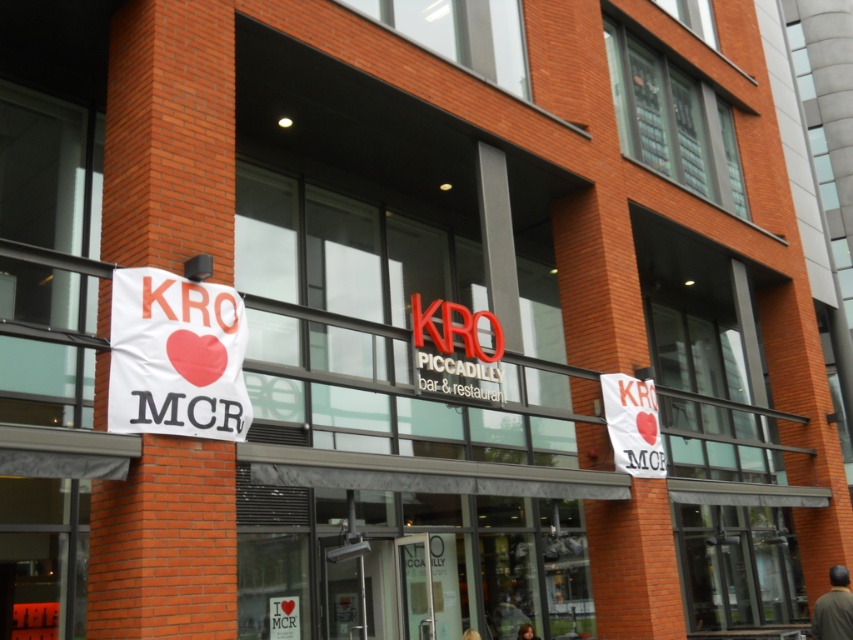
Is point (131, 320) less distant than point (653, 433)?

Yes.

Does white paper banner at left have a greater width compared to white paper banner at center?

Yes, white paper banner at left is wider than white paper banner at center.

Locate an element on the screen. This screenshot has width=853, height=640. white paper banner at left is located at coordinates (177, 356).

Locate an element on the screen. The width and height of the screenshot is (853, 640). white paper banner at center is located at coordinates 633,424.

Does white paper banner at center have a lesser width compared to white paper at center?

No.

Find the location of a particular element. white paper banner at center is located at coordinates (633, 424).

I want to click on white paper banner at center, so pos(633,424).

Who is positioned more to the left, white paper banner at left or white paper at center?

Positioned to the left is white paper banner at left.

Locate an element on the screen. white paper banner at left is located at coordinates (177, 356).

This screenshot has width=853, height=640. Describe the element at coordinates (177, 356) in the screenshot. I see `white paper banner at left` at that location.

Where is `white paper banner at left`? white paper banner at left is located at coordinates (177, 356).